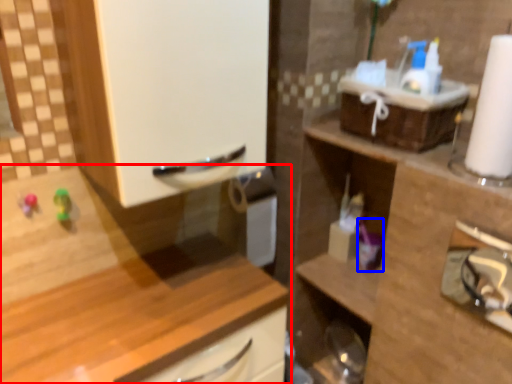
Question: Which of the following is the closest to the observer, cabinetry (highlighted by a red box) or toiletry (highlighted by a blue box)?

Choices:
 (A) cabinetry
 (B) toiletry

Answer: (A)